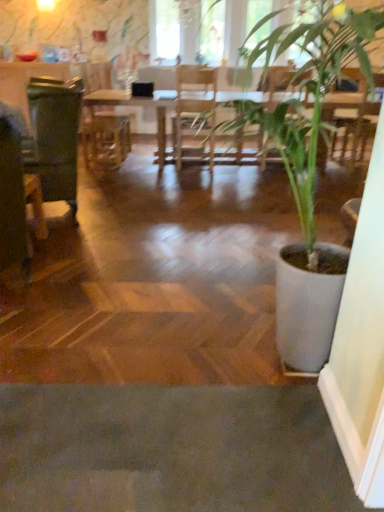
Question: Considering the positions of green matte swivel chair at left and wooden armchair at center in the image, is green matte swivel chair at left wider or thinner than wooden armchair at center?

Choices:
 (A) wide
 (B) thin

Answer: (A)

Question: From a real-world perspective, is green matte swivel chair at left above or below wooden armchair at center?

Choices:
 (A) below
 (B) above

Answer: (A)

Question: Which of these objects is positioned closest to the green leafy plant at center?

Choices:
 (A) green matte swivel chair at left
 (B) wooden armchair at center
 (C) transparent glass window screen at upper center, the 1th window screen viewed from the right
 (D) wooden table at center
 (E) transparent glass window screen at upper center, the 1th window screen positioned from the left

Answer: (A)

Question: Which is farther from the wooden armchair at center?

Choices:
 (A) transparent glass window screen at upper center, the 1th window screen positioned from the left
 (B) green matte swivel chair at left
 (C) green leafy plant at center
 (D) wooden table at center
 (E) transparent glass window screen at upper center, the second window screen when ordered from left to right

Answer: (C)